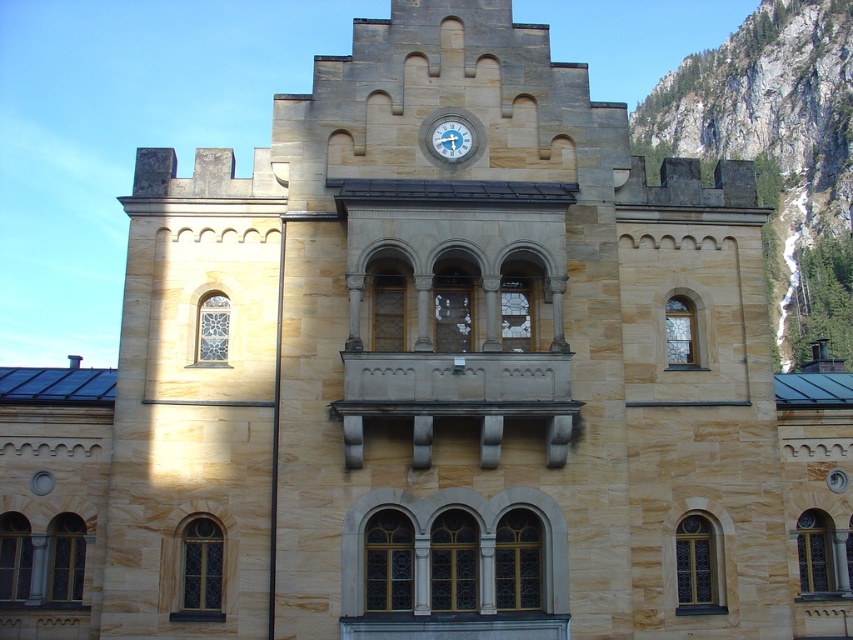
You are an architect analyzing the building in the image. You notice the rocky cliff at upper right and the metallic gray clock at upper center. Which of these two features occupies a greater area on the building facade?

The rocky cliff at upper right is larger in size than the metallic gray clock at upper center, so it occupies a greater area on the building facade.

You are an architect analyzing the symmetry of the building. The building has a rocky cliff at upper right and a metallic gray clock at upper center. Which object is located to the right of the other?

The rocky cliff at upper right is positioned on the right side of metallic gray clock at upper center.

In the scene shown: You are an architect designing a new addition to the building. You need to ensure that the new structure does not block the view of the metallic gray clock at upper center from the main entrance. Considering the rocky cliff at upper right, what should you be cautious about in your design?

You should be cautious about the height of the new structure because the rocky cliff at upper right is much taller than the metallic gray clock at upper center. If the new addition is built too tall, it might block the view of the clock from the main entrance, similar to how the cliff already towers over the clock.